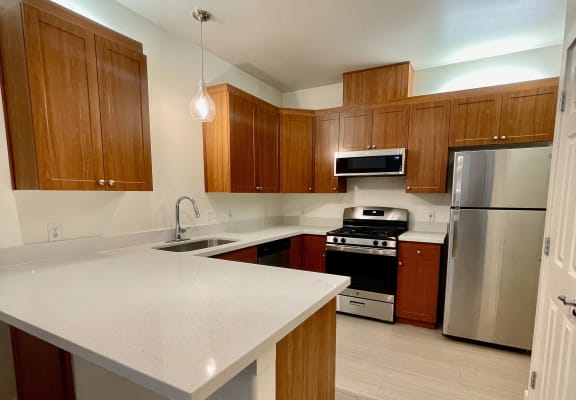
What are the coordinates of `wall` in the screenshot? It's located at (170, 168).